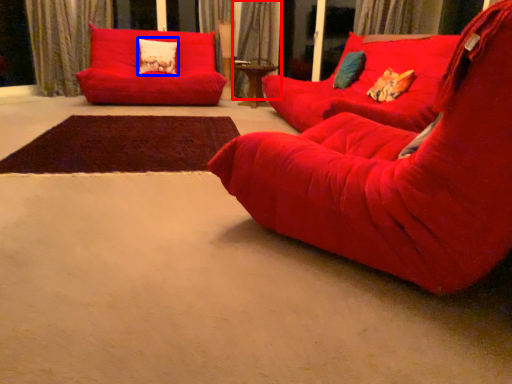
Question: Which point is further to the camera, curtain (highlighted by a red box) or pillow (highlighted by a blue box)?

Choices:
 (A) curtain
 (B) pillow

Answer: (A)